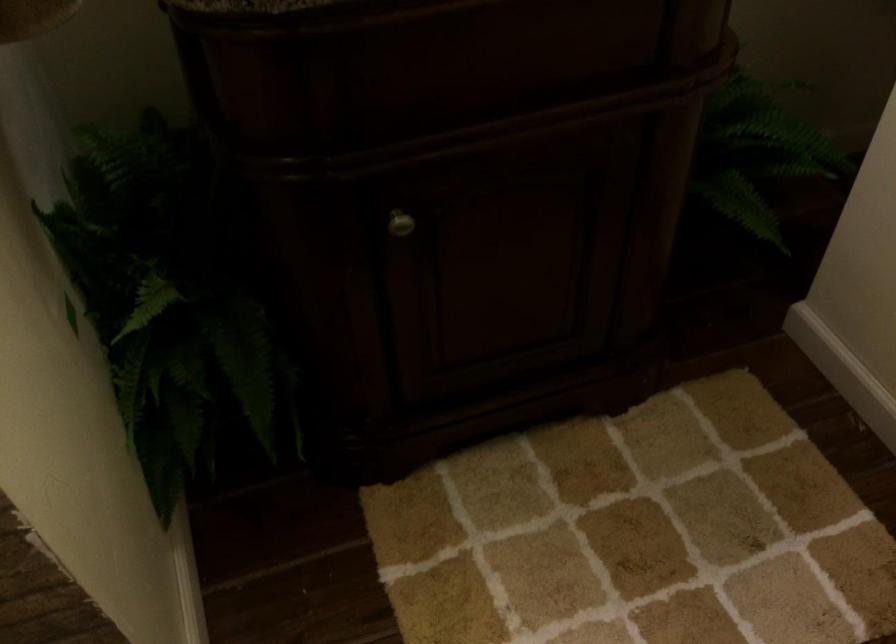
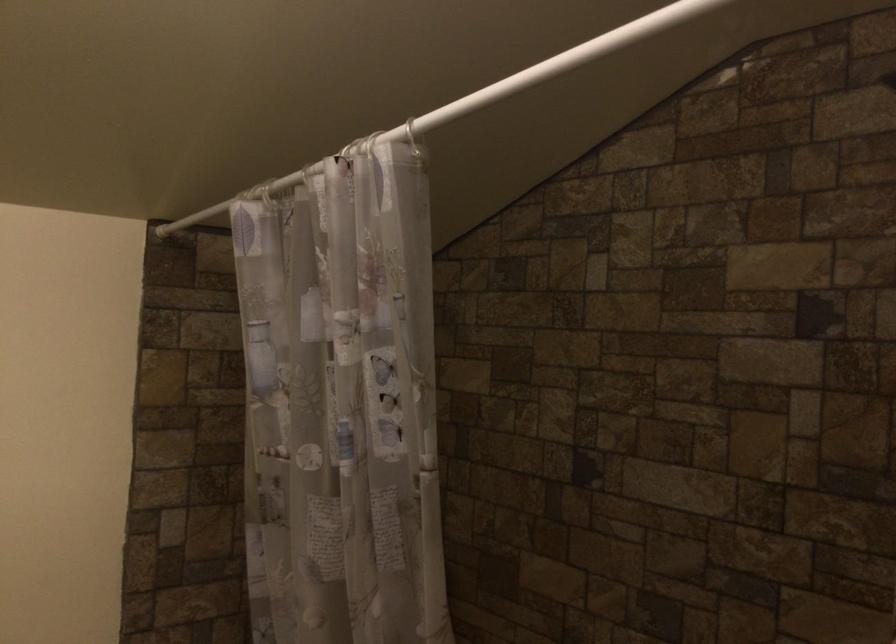
The first image is from the beginning of the video and the second image is from the end. How did the camera likely rotate when shooting the video?

The camera rotated toward left-up.